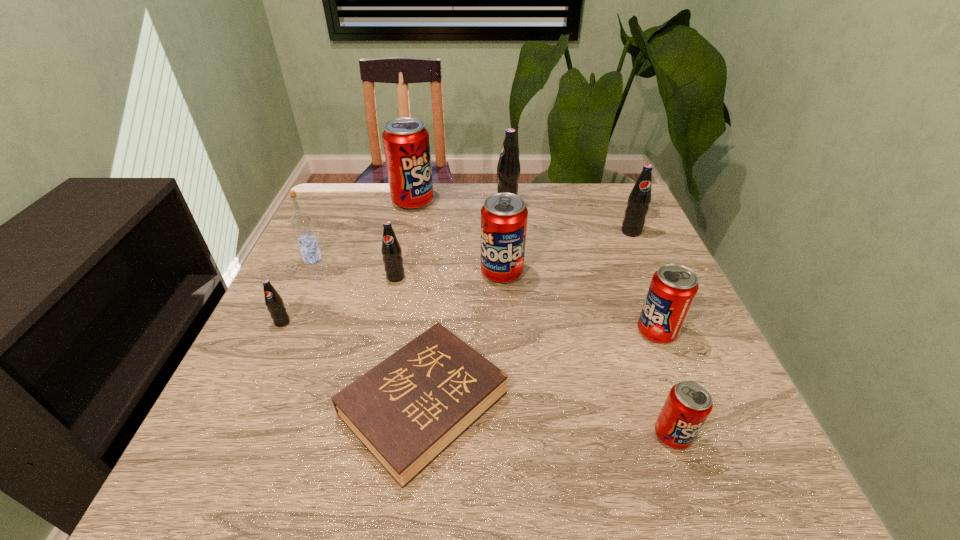
In order to click on vacant space that satisfies the following two spatial constraints: 1. on the front label of the brown hardback book; 2. on the right side of the smallest black pop in this screenshot , I will do `click(245, 404)`.

Where is `vacant space that satisfies the following two spatial constraints: 1. on the front label of the second black pop from right to left; 2. on the front side of the third smallest red soda can`? This screenshot has width=960, height=540. vacant space that satisfies the following two spatial constraints: 1. on the front label of the second black pop from right to left; 2. on the front side of the third smallest red soda can is located at coordinates (513, 273).

Locate an element on the screen. This screenshot has width=960, height=540. vacant space that satisfies the following two spatial constraints: 1. on the front label of the second smallest red soda can; 2. on the left side of the third black pop from right to left is located at coordinates coord(384,332).